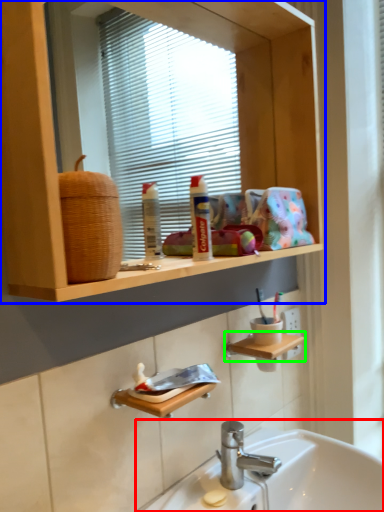
Question: Which is farther away from sink (highlighted by a red box)? bathroom cabinet (highlighted by a blue box) or shelf (highlighted by a green box)?

Choices:
 (A) bathroom cabinet
 (B) shelf

Answer: (A)